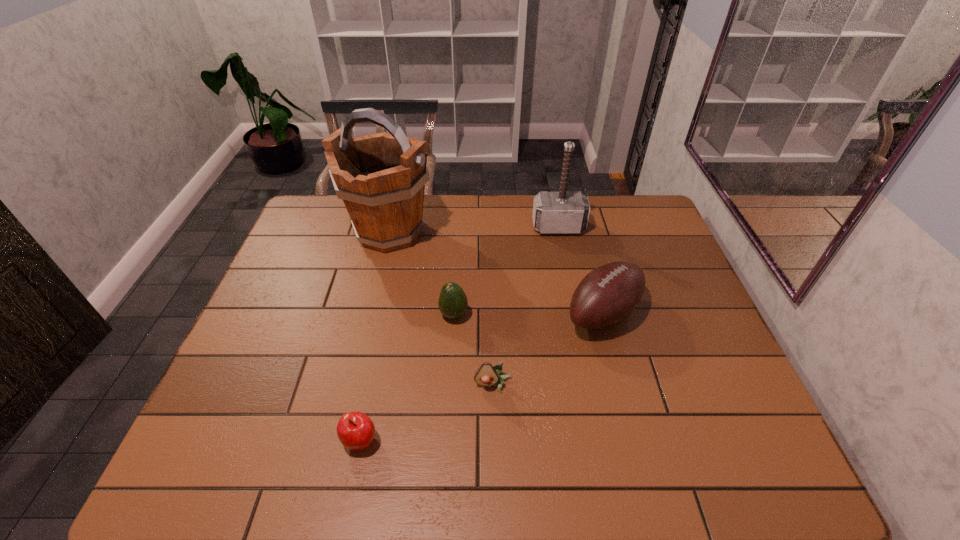
At what (x,y) coordinates should I click in order to perform the action: click on vacant space that satisfies the following two spatial constraints: 1. on the back side of the nearest object; 2. on the right side of the fourth tallest object. Please return your answer as a coordinate pair (x, y). The image size is (960, 540). Looking at the image, I should click on (386, 315).